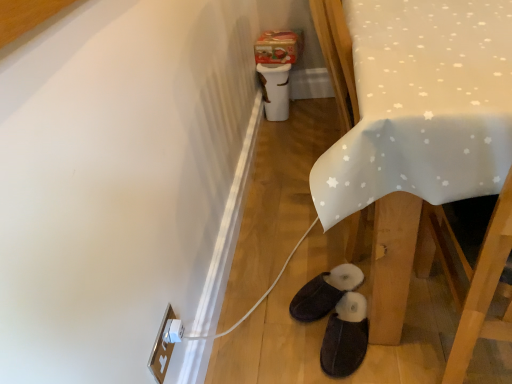
Question: Which direction should I rotate to look at dark brown suede slippers at lower center, which ranks as the second footwear in back-to-front order, — up or down?

Choices:
 (A) down
 (B) up

Answer: (A)

Question: Is white fabric table at lower right positioned far away from black suede slippers at lower center, arranged as the second footwear when viewed from the front?

Choices:
 (A) yes
 (B) no

Answer: (B)

Question: From the image's perspective, is white fabric table at lower right on top of black suede slippers at lower center, which is counted as the 1th footwear, starting from the back?

Choices:
 (A) no
 (B) yes

Answer: (B)

Question: Can you confirm if white fabric table at lower right is bigger than black suede slippers at lower center, which is counted as the 1th footwear, starting from the back?

Choices:
 (A) no
 (B) yes

Answer: (B)

Question: Considering the relative sizes of white fabric table at lower right and black suede slippers at lower center, which is counted as the 1th footwear, starting from the back, in the image provided, is white fabric table at lower right wider than black suede slippers at lower center, which is counted as the 1th footwear, starting from the back,?

Choices:
 (A) yes
 (B) no

Answer: (A)

Question: From the image's perspective, is white fabric table at lower right located beneath black suede slippers at lower center, arranged as the second footwear when viewed from the front?

Choices:
 (A) no
 (B) yes

Answer: (A)

Question: Does white fabric table at lower right appear on the right side of black suede slippers at lower center, which is counted as the 1th footwear, starting from the back?

Choices:
 (A) no
 (B) yes

Answer: (B)

Question: From the image's perspective, does white fabric table at lower right appear lower than dark brown suede slippers at lower center, which ranks as the second footwear in back-to-front order?

Choices:
 (A) yes
 (B) no

Answer: (B)

Question: Can you confirm if white fabric table at lower right is positioned to the right of dark brown suede slippers at lower center, the 1th footwear in the front-to-back sequence?

Choices:
 (A) yes
 (B) no

Answer: (A)

Question: Is white fabric table at lower right facing towards dark brown suede slippers at lower center, which ranks as the second footwear in back-to-front order?

Choices:
 (A) yes
 (B) no

Answer: (B)

Question: Is white fabric table at lower right positioned with its back to dark brown suede slippers at lower center, which ranks as the second footwear in back-to-front order?

Choices:
 (A) no
 (B) yes

Answer: (A)

Question: Does white fabric table at lower right have a greater height compared to dark brown suede slippers at lower center, the 1th footwear in the front-to-back sequence?

Choices:
 (A) yes
 (B) no

Answer: (A)

Question: Does white fabric table at lower right have a larger size compared to dark brown suede slippers at lower center, the 1th footwear in the front-to-back sequence?

Choices:
 (A) yes
 (B) no

Answer: (A)

Question: Would you say dark brown suede slippers at lower center, which ranks as the second footwear in back-to-front order, contains black suede slippers at lower center, arranged as the second footwear when viewed from the front?

Choices:
 (A) no
 (B) yes

Answer: (A)